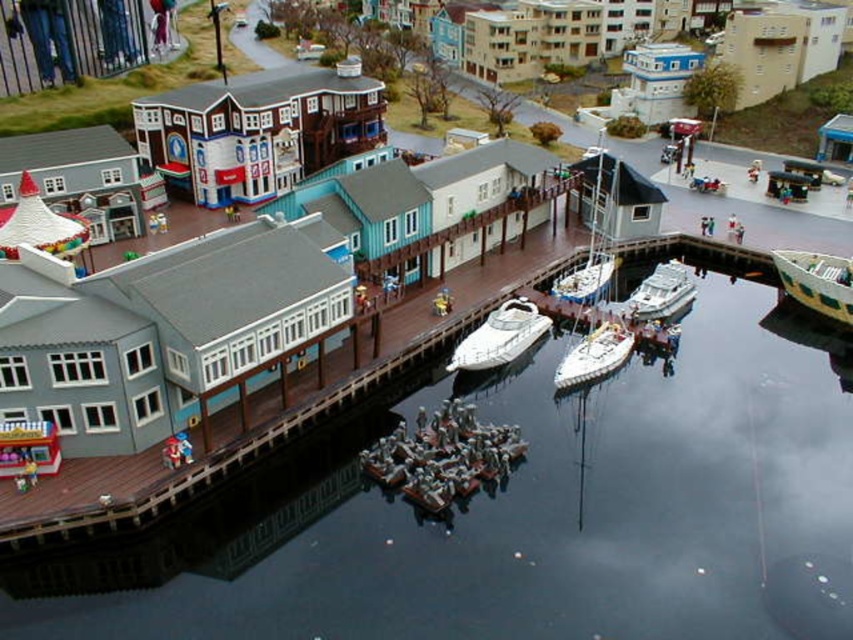
Consider the image. You are a model boat operator who wants to navigate your metallic silver boats at center under the wooden dock at center. Can your boat pass underneath?

The wooden dock at center is taller than metallic silver boats at center, so the boat can pass underneath as long as its height does not exceed the dock clearance.

You are a model boat operator trying to navigate your metallic silver boats at center through the water. There is a wooden dock at center in your path. Can you safely pass under the dock without hitting it?

The wooden dock at center is above the metallic silver boats at center, so yes, the boats can safely pass under the dock without hitting it.

You are a model boat operator in the miniature waterfront scene. You need to navigate your white matte sailboat at center to a docking station. According to the scene, where is the wooden dock at center located relative to your boat?

The wooden dock at center is above the white matte sailboat at center, so the boat should navigate upwards to reach the dock.